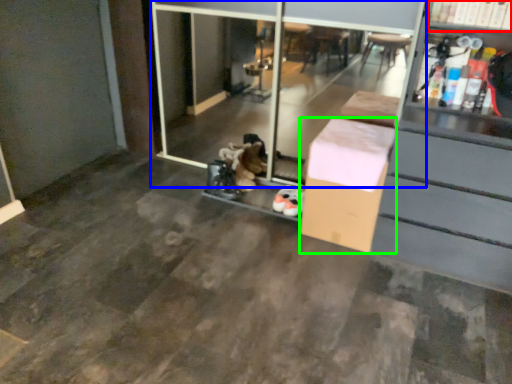
Question: Which is nearer to the shelf (highlighted by a red box)? screen door (highlighted by a blue box) or box (highlighted by a green box).

Choices:
 (A) screen door
 (B) box

Answer: (B)